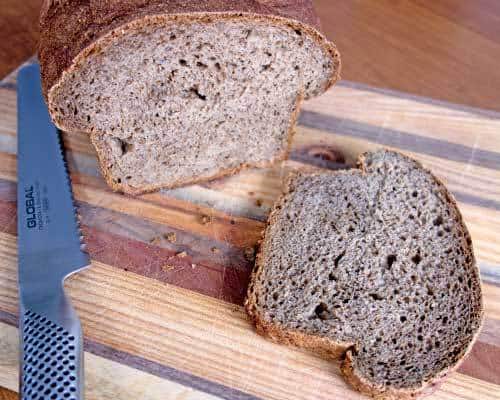
Identify the location of cutting board. (423, 126).